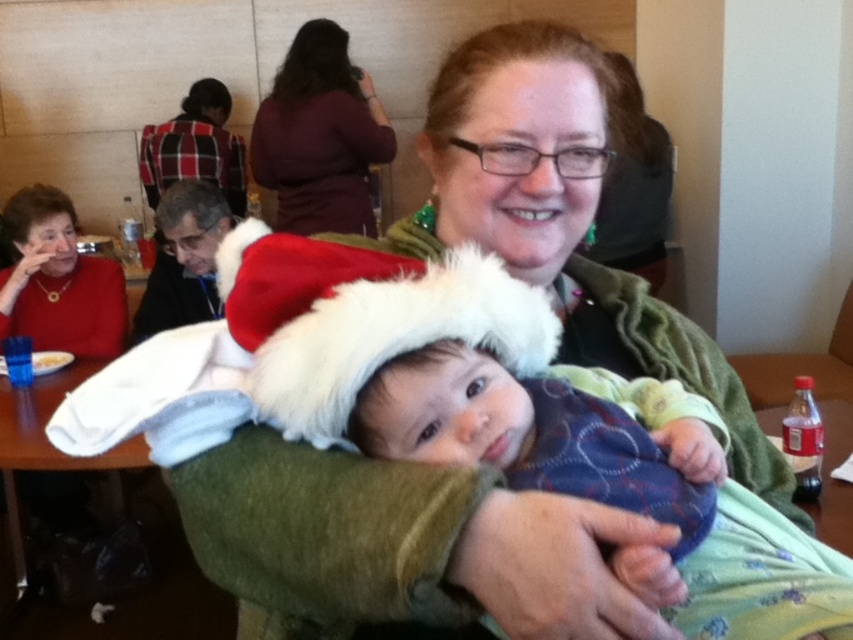
Question: In this image, where is white fluffy santa hat at center located relative to maroon sweater at upper center?

Choices:
 (A) right
 (B) left

Answer: (A)

Question: Which point is closer to the camera taking this photo?

Choices:
 (A) (544, 344)
 (B) (218, 90)

Answer: (A)

Question: Based on their relative distances, which object is farther from the wooden table at lower left?

Choices:
 (A) matte red sweater at left
 (B) plaid fabric shirt at upper left
 (C) maroon sweater at upper center

Answer: (B)

Question: Where is white fluffy santa hat at center located in relation to wooden table at lower left in the image?

Choices:
 (A) above
 (B) below

Answer: (A)

Question: Which object is positioned closest to the maroon sweater at upper center?

Choices:
 (A) matte red sweater at left
 (B) white fluffy santa hat at center
 (C) plaid fabric shirt at upper left
 (D) wooden table at lower left

Answer: (C)

Question: Can you confirm if white fluffy santa hat at center is positioned above plaid fabric shirt at upper left?

Choices:
 (A) yes
 (B) no

Answer: (B)